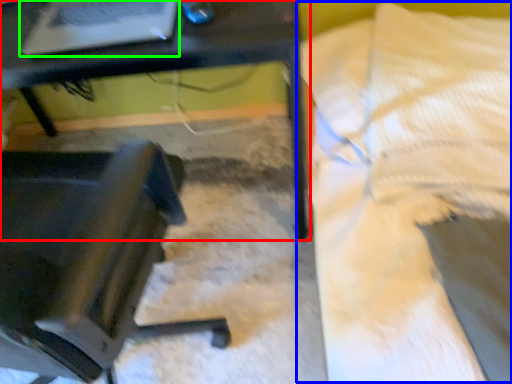
Question: Which object is the farthest from table (highlighted by a red box)? Choose among these: bed (highlighted by a blue box) or laptop (highlighted by a green box).

Choices:
 (A) bed
 (B) laptop

Answer: (A)